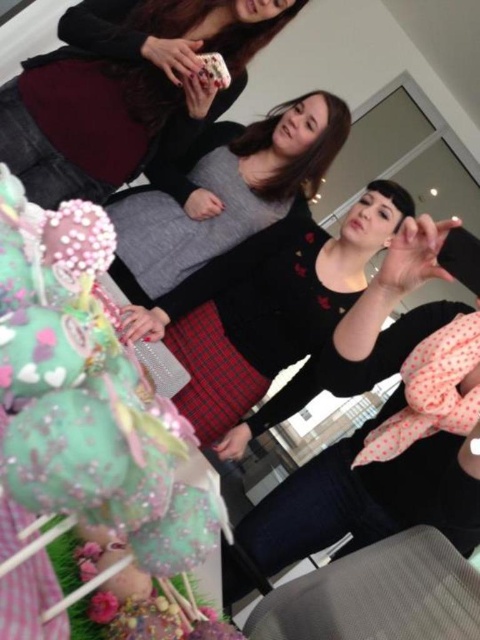
Question: Is matte black phone at upper center in front of pink dotted fabric at center?

Choices:
 (A) yes
 (B) no

Answer: (B)

Question: Is matte black phone at upper center below pink dotted fabric at center?

Choices:
 (A) no
 (B) yes

Answer: (A)

Question: Which point is farther from the camera taking this photo?

Choices:
 (A) (360, 467)
 (B) (230, 131)
 (C) (49, 86)

Answer: (B)

Question: Which of the following is the closest to the observer?

Choices:
 (A) black matte dress at center
 (B) matte black phone at upper center
 (C) pink dotted fabric at center

Answer: (C)

Question: Which point is farther to the camera?

Choices:
 (A) pink dotted fabric at center
 (B) matte black phone at upper center

Answer: (B)

Question: Can you confirm if matte black phone at upper center is bigger than black matte dress at center?

Choices:
 (A) yes
 (B) no

Answer: (A)